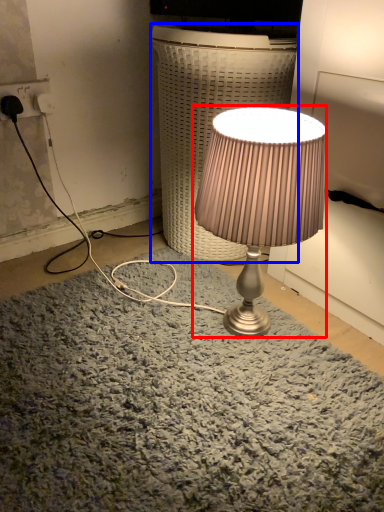
Question: Which point is closer to the camera, lamp (highlighted by a red box) or table (highlighted by a blue box)?

Choices:
 (A) lamp
 (B) table

Answer: (A)